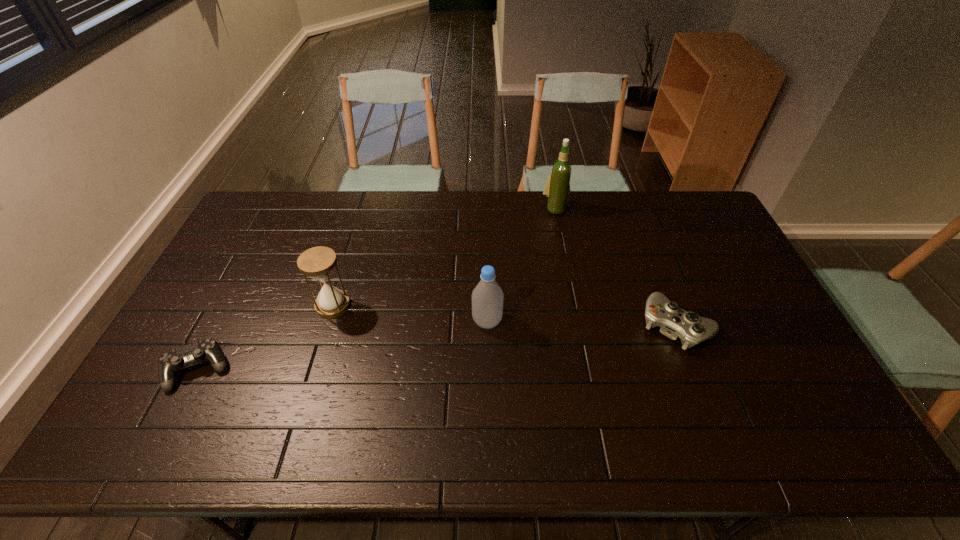
The height and width of the screenshot is (540, 960). In the image, there is a desktop. In order to click on free region at the far right corner in this screenshot , I will do `click(669, 198)`.

The image size is (960, 540). I want to click on free space between the shortest object and the fourth object from left to right, so click(377, 289).

I want to click on vacant space that is in between the wine bottle and the hourglass, so click(444, 257).

Locate an element on the screen. Image resolution: width=960 pixels, height=540 pixels. free space between the third object from left to right and the farthest object is located at coordinates (521, 265).

Where is `vacant point located between the farthest object and the third object from right to left`? vacant point located between the farthest object and the third object from right to left is located at coordinates (521, 265).

Image resolution: width=960 pixels, height=540 pixels. I want to click on vacant area that lies between the third object from right to left and the wine bottle, so click(x=521, y=265).

You are a GUI agent. You are given a task and a screenshot of the screen. Output one action in this format:
    pyautogui.click(x=<x>, y=<y>)
    Task: Click on the free space between the rightmost object and the tallest object
    The image size is (960, 540).
    Given the screenshot: What is the action you would take?
    click(x=615, y=267)

Locate an element on the screen. unoccupied area between the leftmost object and the second shortest object is located at coordinates (438, 347).

Identify the location of free space between the second object from left to right and the taller control. The image size is (960, 540). (505, 315).

This screenshot has height=540, width=960. In order to click on free space between the fourth object from left to right and the hourglass in this screenshot , I will do `click(444, 257)`.